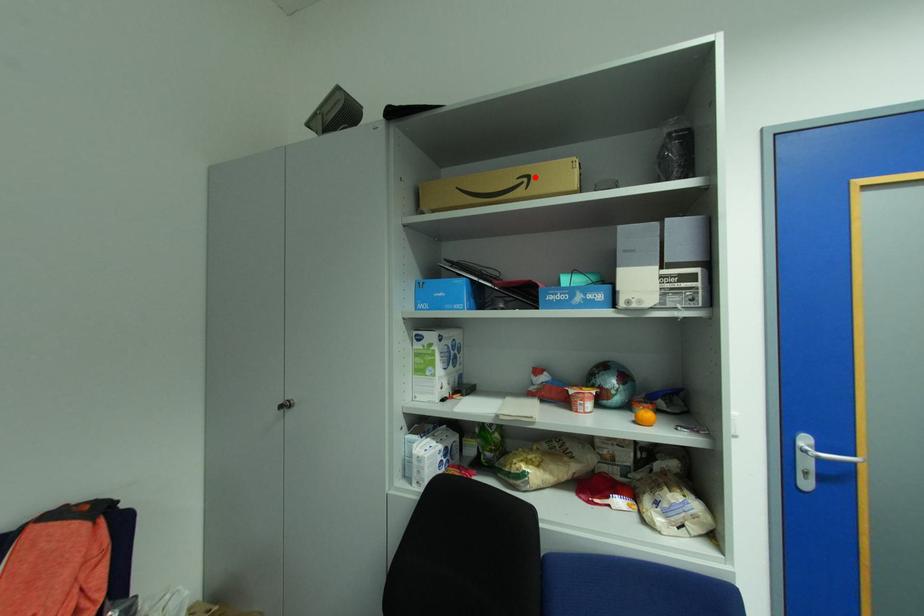
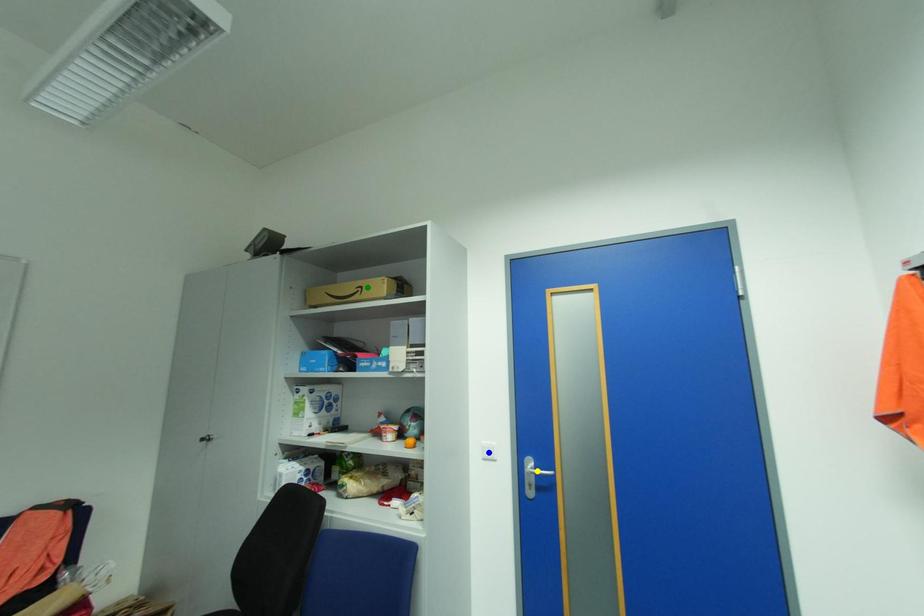
Question: I am providing you with two images of the same scene from different viewpoints. A red point is marked on the first image. You are given multiple points on the second image. Which spot in image 2 lines up with the point in image 1?

Choices:
 (A) green point
 (B) yellow point
 (C) blue point

Answer: (A)